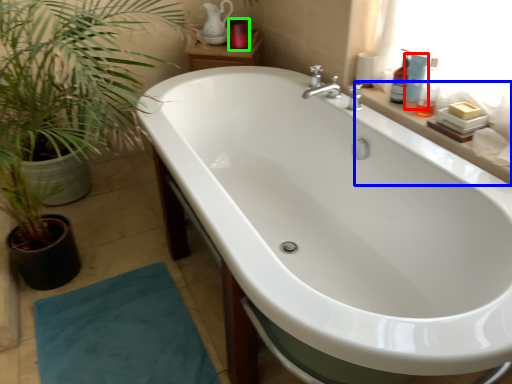
Question: Estimate the real-world distances between objects in this image. Which object is closer to toiletry (highlighted by a red box), counter top (highlighted by a blue box) or toiletry (highlighted by a green box)?

Choices:
 (A) counter top
 (B) toiletry

Answer: (A)